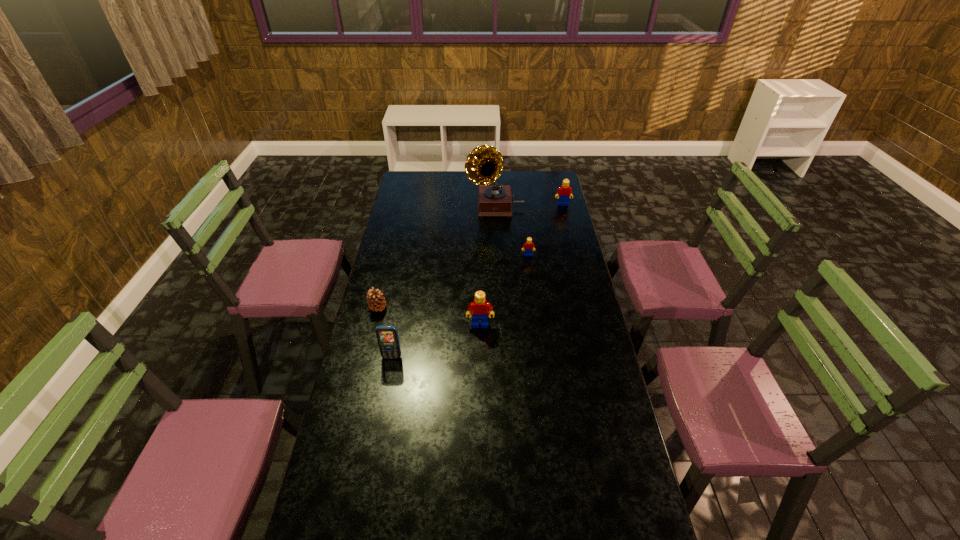
The image size is (960, 540). In order to click on free point that keeps the Legos evenly spaced on the left in this screenshot , I will do `click(410, 426)`.